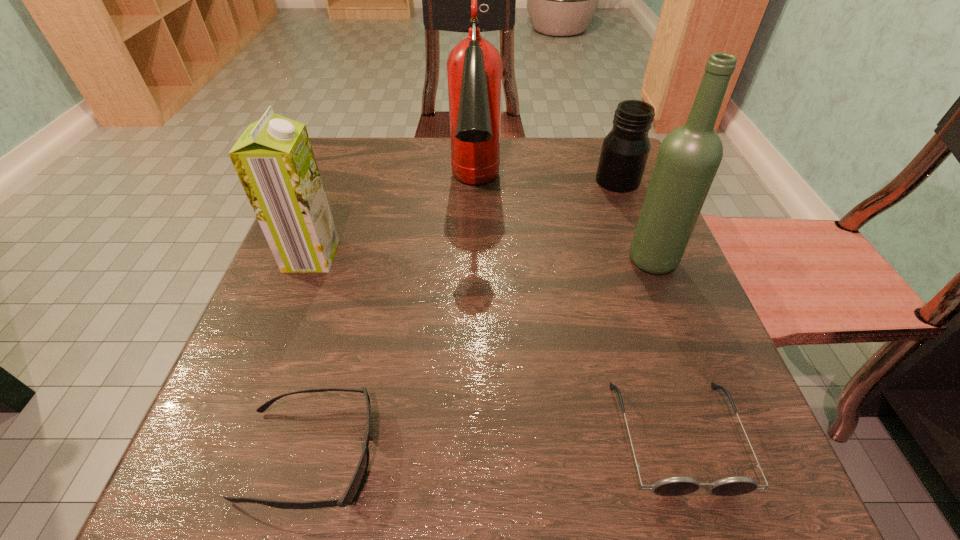
You are a GUI agent. You are given a task and a screenshot of the screen. Output one action in this format:
    pyautogui.click(x=<x>, y=<y>)
    Task: Click on the vacant space in between the left sunglasses and the jar
    
    Given the screenshot: What is the action you would take?
    pyautogui.click(x=464, y=318)

This screenshot has height=540, width=960. Identify the location of vacant area that lies between the fourth object from right to left and the wine bottle. (564, 225).

Find the location of a particular element. This screenshot has width=960, height=540. vacant point located between the jar and the wine bottle is located at coordinates (635, 220).

You are a GUI agent. You are given a task and a screenshot of the screen. Output one action in this format:
    pyautogui.click(x=<x>, y=<y>)
    Task: Click on the free space between the fourth object from right to left and the wine bottle
    Image resolution: width=960 pixels, height=540 pixels.
    Given the screenshot: What is the action you would take?
    pyautogui.click(x=564, y=225)

Where is `empty location between the soya milk and the left sunglasses`? Image resolution: width=960 pixels, height=540 pixels. empty location between the soya milk and the left sunglasses is located at coordinates (310, 355).

I want to click on vacant space in between the right sunglasses and the jar, so click(x=647, y=308).

Find the location of a particular element. vacant area that lies between the right sunglasses and the jar is located at coordinates (647, 308).

Image resolution: width=960 pixels, height=540 pixels. Find the location of `vacant space that is in between the soya milk and the right sunglasses`. vacant space that is in between the soya milk and the right sunglasses is located at coordinates click(x=494, y=346).

Select which object appears as the fourth closest to the third tallest object. Please provide its 2D coordinates. Your answer should be formatted as a tuple, i.e. [(x, y)], where the tuple contains the x and y coordinates of a point satisfying the conditions above.

[(689, 156)]

Where is `object that is the second closest to the soya milk`? Image resolution: width=960 pixels, height=540 pixels. object that is the second closest to the soya milk is located at coordinates (352, 491).